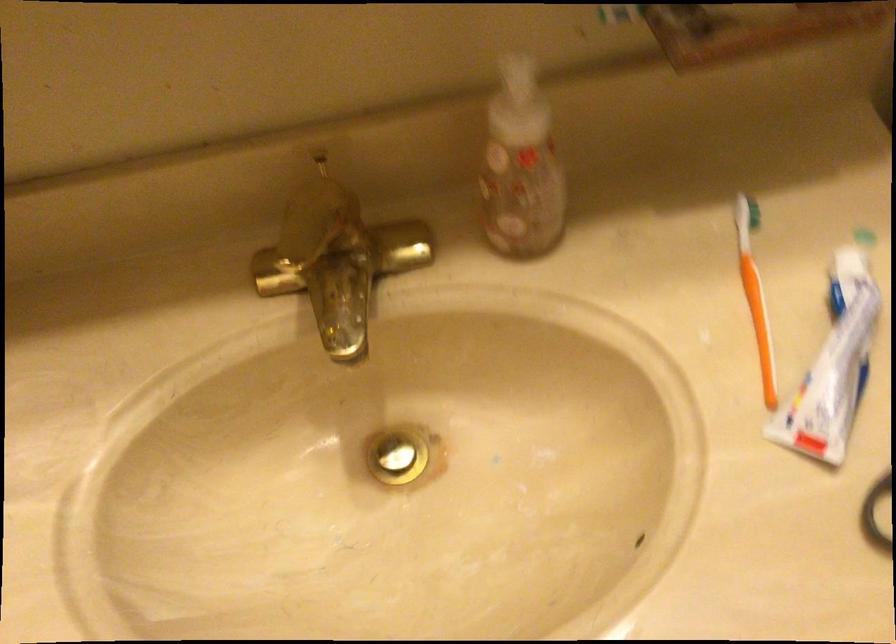
Identify the location of sink drain lever. (341, 301).